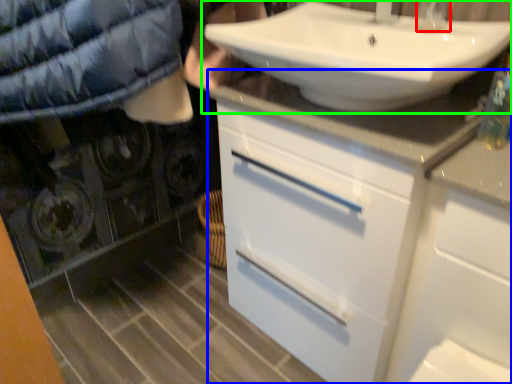
Question: Which object is the farthest from faucet (highlighted by a red box)? Choose among these: bathroom cabinet (highlighted by a blue box) or sink (highlighted by a green box).

Choices:
 (A) bathroom cabinet
 (B) sink

Answer: (A)